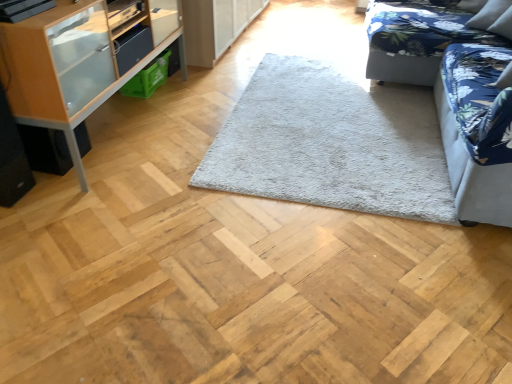
Identify the location of free area below gray fluffy rug at center (from a real-world perspective). This screenshot has height=384, width=512. (326, 120).